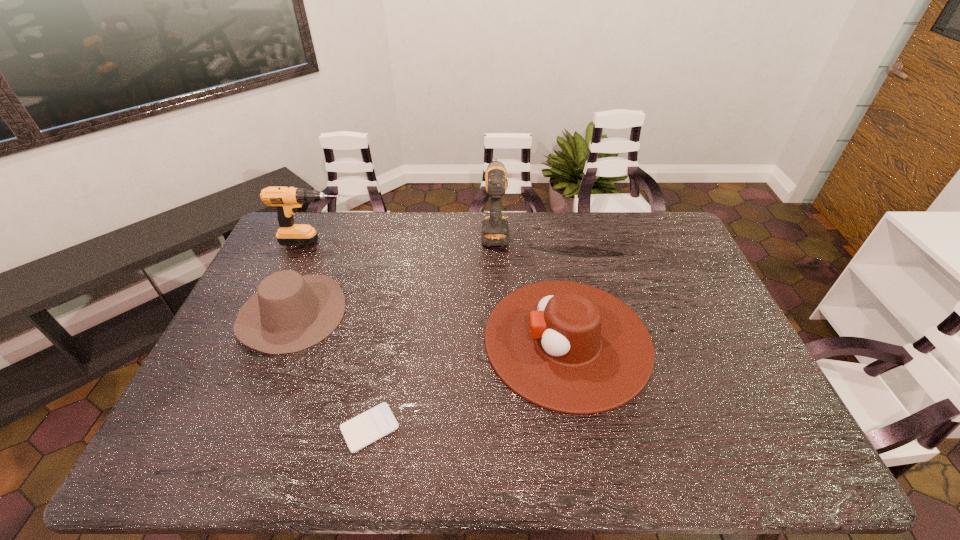
I want to click on vacant space located on the front-facing side of the right cowboy hat, so click(x=415, y=340).

Locate an element on the screen. This screenshot has width=960, height=540. free region located 0.270m on the front-facing side of the right cowboy hat is located at coordinates (391, 340).

The image size is (960, 540). Identify the location of vacant area located 0.090m on the right of the left cowboy hat. (373, 313).

Where is `free space located 0.090m on the left of the shortest object`? free space located 0.090m on the left of the shortest object is located at coordinates (303, 428).

The height and width of the screenshot is (540, 960). Find the location of `object that is positioned at the near edge`. object that is positioned at the near edge is located at coordinates (364, 429).

The height and width of the screenshot is (540, 960). Identify the location of drill that is positioned at the left edge. (286, 200).

The height and width of the screenshot is (540, 960). Find the location of `cowboy hat that is at the left edge`. cowboy hat that is at the left edge is located at coordinates (289, 313).

This screenshot has width=960, height=540. I want to click on object that is at the far left corner, so click(x=286, y=200).

You are a GUI agent. You are given a task and a screenshot of the screen. Output one action in this format:
    pyautogui.click(x=<x>, y=<y>)
    Task: Click on the free space at the far edge of the desktop
    The width and height of the screenshot is (960, 540).
    Given the screenshot: What is the action you would take?
    pyautogui.click(x=469, y=229)

Where is `vacant space at the near edge`? The image size is (960, 540). vacant space at the near edge is located at coordinates (245, 443).